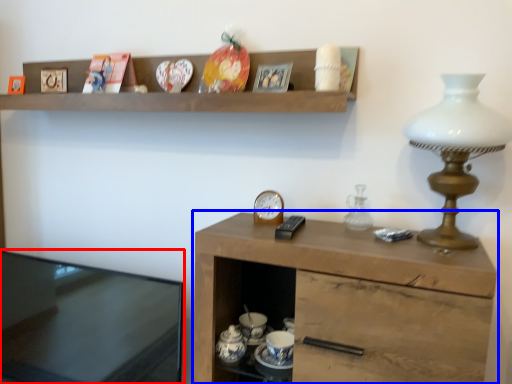
Question: Which object appears closest to the camera in this image, desk (highlighted by a red box) or cabinetry (highlighted by a blue box)?

Choices:
 (A) desk
 (B) cabinetry

Answer: (B)